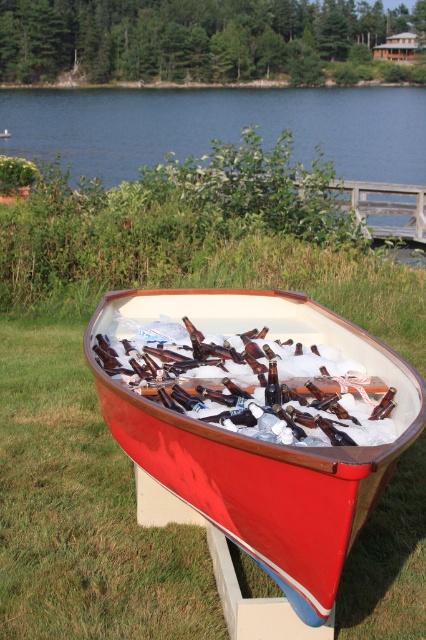
Does shiny red canoe at center have a larger size compared to blue water at upper center?

Incorrect, shiny red canoe at center is not larger than blue water at upper center.

Who is higher up, shiny red canoe at center or blue water at upper center?

blue water at upper center

What do you see at coordinates (255, 429) in the screenshot?
I see `shiny red canoe at center` at bounding box center [255, 429].

The image size is (426, 640). In order to click on shiny red canoe at center in this screenshot , I will do `click(255, 429)`.